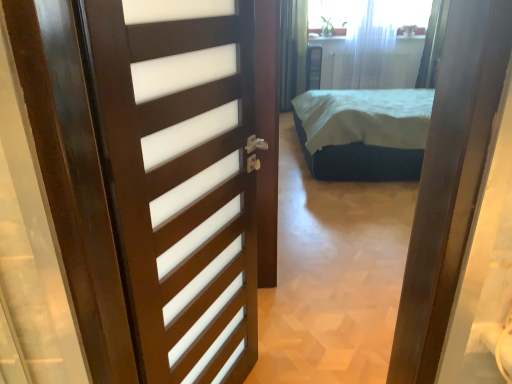
Question: Considering the relative positions of white sheer curtain at upper center and dark green fabric bed at center in the image provided, is white sheer curtain at upper center to the left of dark green fabric bed at center from the viewer's perspective?

Choices:
 (A) yes
 (B) no

Answer: (B)

Question: Is white sheer curtain at upper center not inside dark green fabric bed at center?

Choices:
 (A) no
 (B) yes

Answer: (B)

Question: Is white sheer curtain at upper center far from dark green fabric bed at center?

Choices:
 (A) yes
 (B) no

Answer: (A)

Question: Is white sheer curtain at upper center looking in the opposite direction of dark green fabric bed at center?

Choices:
 (A) yes
 (B) no

Answer: (B)

Question: Is dark green fabric bed at center a part of white sheer curtain at upper center?

Choices:
 (A) no
 (B) yes

Answer: (A)

Question: In the image, is dark green fabric bed at center on the left side or the right side of white sheer curtain at upper center?

Choices:
 (A) left
 (B) right

Answer: (A)

Question: Relative to white sheer curtain at upper center, is dark green fabric bed at center in front or behind?

Choices:
 (A) front
 (B) behind

Answer: (A)

Question: Does point click(x=406, y=122) appear closer or farther from the camera than point click(x=346, y=74)?

Choices:
 (A) closer
 (B) farther

Answer: (A)

Question: Is dark green fabric bed at center wider or thinner than white sheer curtain at upper center?

Choices:
 (A) thin
 (B) wide

Answer: (B)

Question: From the image's perspective, is dark wood door at left above or below dark green fabric bed at center?

Choices:
 (A) above
 (B) below

Answer: (B)

Question: Considering their positions, is dark wood door at left located in front of or behind dark green fabric bed at center?

Choices:
 (A) behind
 (B) front

Answer: (B)

Question: In terms of height, does dark wood door at left look taller or shorter compared to dark green fabric bed at center?

Choices:
 (A) short
 (B) tall

Answer: (B)

Question: Which is correct: dark wood door at left is inside dark green fabric bed at center, or outside of it?

Choices:
 (A) inside
 (B) outside

Answer: (B)

Question: From a real-world perspective, is white sheer curtain at upper center above or below dark wood door at left?

Choices:
 (A) above
 (B) below

Answer: (A)

Question: Would you say white sheer curtain at upper center is inside or outside dark wood door at left?

Choices:
 (A) outside
 (B) inside

Answer: (A)